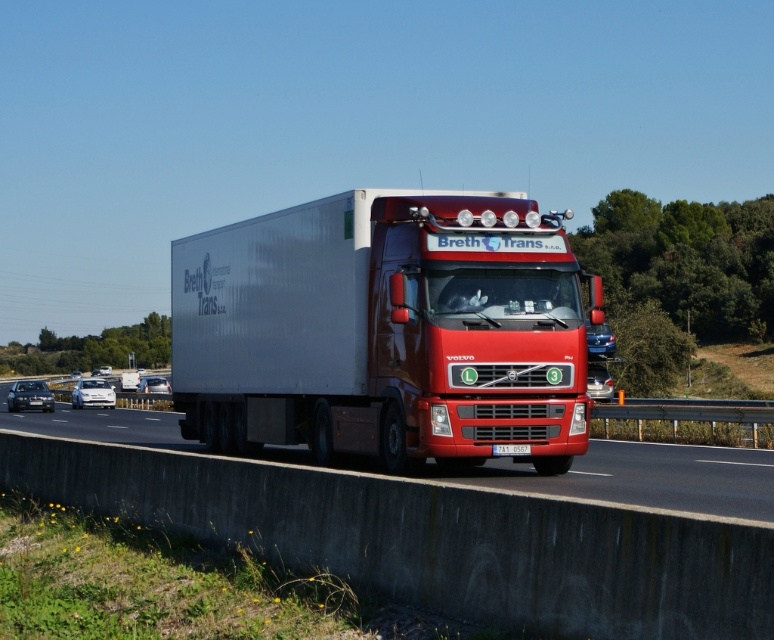
Between point (536, 211) and point (509, 456), which one is positioned behind?

The point (536, 211) is behind.

Which is in front, point (514, 209) or point (519, 456)?

Positioned in front is point (519, 456).

Identify the location of metallic silver trailer at center. (382, 330).

Is point (173, 348) positioned behind point (271, 451)?

Yes, point (173, 348) is behind point (271, 451).

Between metallic silver trailer at center and metallic gray highway at center, which one has more height?

metallic silver trailer at center is taller.

Where is `metallic silver trailer at center`? The height and width of the screenshot is (640, 774). metallic silver trailer at center is located at coordinates (382, 330).

Can you confirm if metallic gray highway at center is positioned above black plastic license plate at center?

Actually, metallic gray highway at center is below black plastic license plate at center.

Which is behind, point (608, 493) or point (491, 451)?

The point (491, 451) is behind.

Identify the location of metallic gray highway at center. Image resolution: width=774 pixels, height=640 pixels. (646, 477).

Where is `metallic gray highway at center`? metallic gray highway at center is located at coordinates (646, 477).